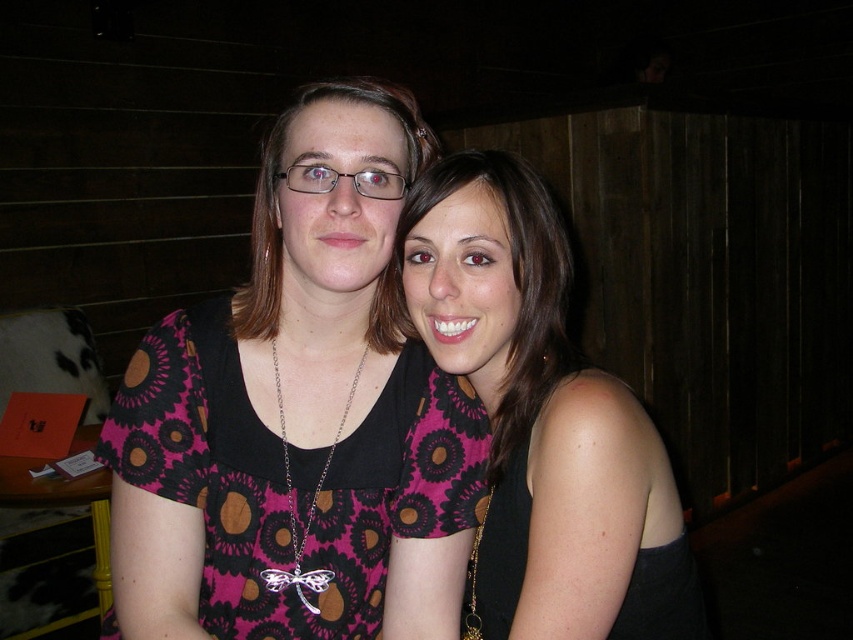
Question: Which object is positioned closest to the pink printed fabric dress at center?

Choices:
 (A) pink floral dress at center
 (B) black matte dress at right
 (C) pink dotted dress at center

Answer: (A)

Question: Does pink printed fabric dress at center have a greater width compared to black matte dress at right?

Choices:
 (A) no
 (B) yes

Answer: (B)

Question: Which point is closer to the camera?

Choices:
 (A) pink printed fabric dress at center
 (B) pink floral dress at center
 (C) black matte dress at right

Answer: (B)

Question: Which of the following is the farthest from the observer?

Choices:
 (A) pink dotted dress at center
 (B) pink floral dress at center

Answer: (B)

Question: Does pink floral dress at center have a lesser width compared to pink dotted dress at center?

Choices:
 (A) no
 (B) yes

Answer: (A)

Question: Is pink floral dress at center positioned at the back of pink printed fabric dress at center?

Choices:
 (A) yes
 (B) no

Answer: (B)